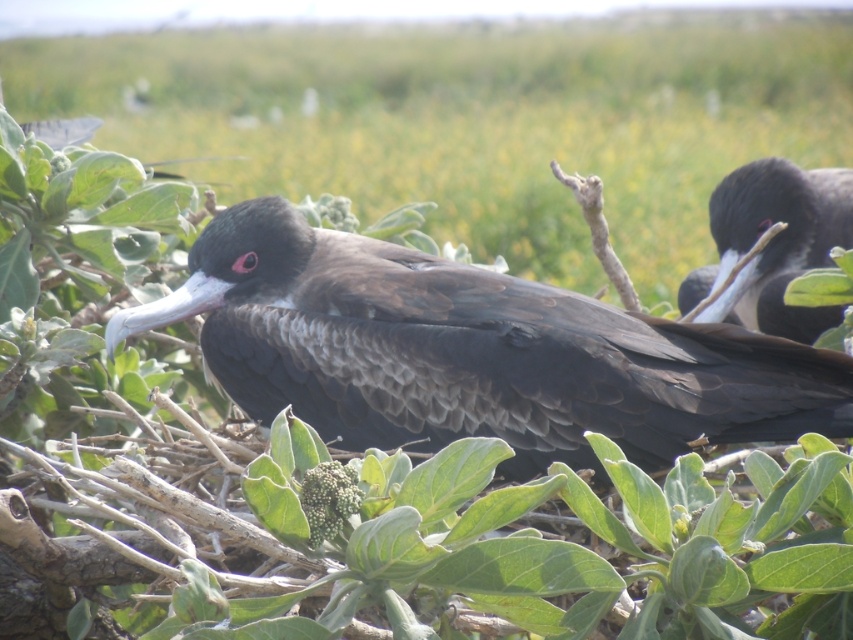
You are a wildlife photographer aiming to capture the matte black bird at center. According to the coordinates provided, where should you focus your camera to ensure the bird is centered in your shot?

You should focus your camera at point coordinates (x=473, y=353) to center the matte black bird at center in your shot.